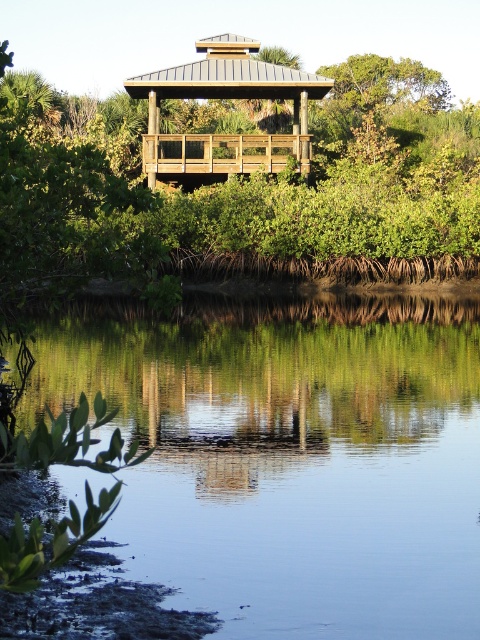
You are standing at the edge of the wooden deck and want to locate the clear water at lower center. According to the coordinates provided, where would you look relative to your position?

The clear water at lower center is located at coordinates point (289, 454), so you should look towards the lower center direction from your position on the wooden deck.

You are standing at the edge of the wooden deck and want to throw a stone into the clear water at lower center. Considering the distance from where you are standing to the water, will the stone reach the water if you throw it with a typical adult strength?

The clear water at lower center is 5.42 meters away. Since the average throwing distance for an adult is around 10 meters, the stone will likely reach the water.